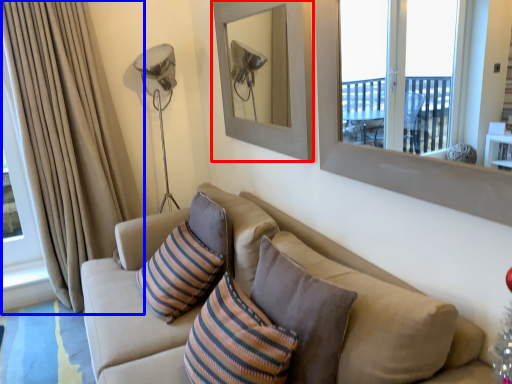
Question: Among these objects, which one is farthest to the camera, picture frame (highlighted by a red box) or curtain (highlighted by a blue box)?

Choices:
 (A) picture frame
 (B) curtain

Answer: (B)